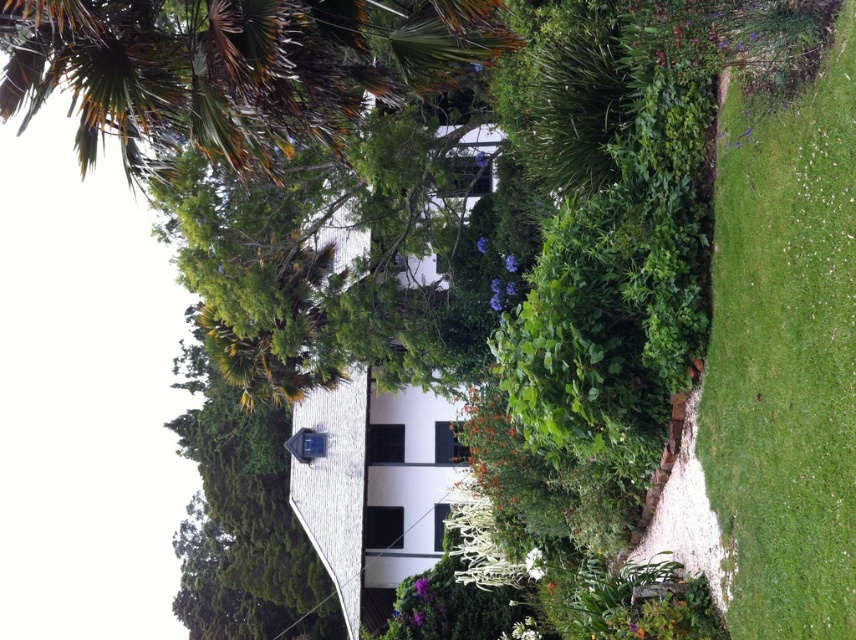
Which is below, green grass at right or brown textured palm tree at upper left?

green grass at right is below.

Looking at this image, does green grass at right appear over brown textured palm tree at upper left?

Actually, green grass at right is below brown textured palm tree at upper left.

Which is in front, point (840, 88) or point (278, 113)?

Positioned in front is point (840, 88).

Find the location of a particular element. This screenshot has height=640, width=856. green grass at right is located at coordinates (785, 353).